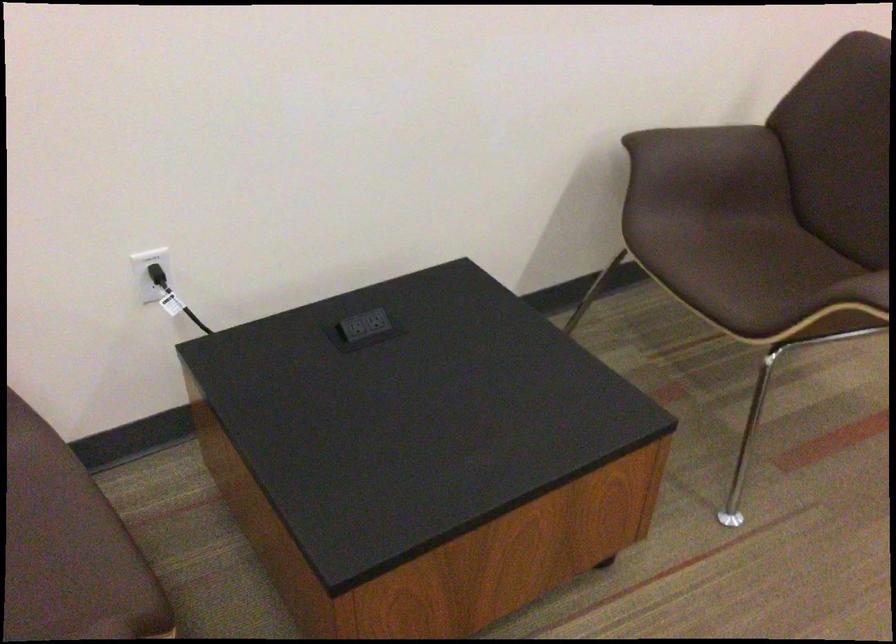
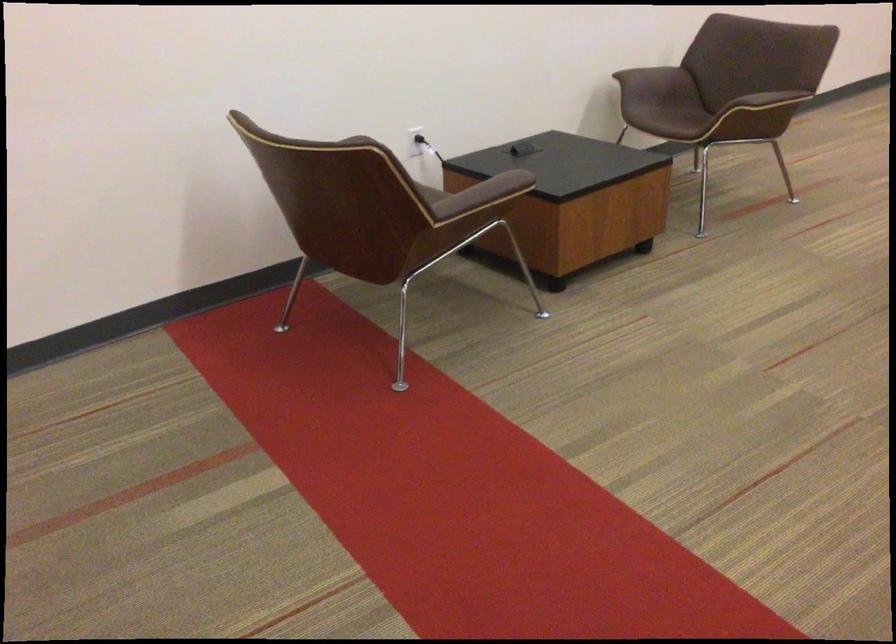
Find the pixel in the second image that matches point (151, 292) in the first image.

(417, 140)